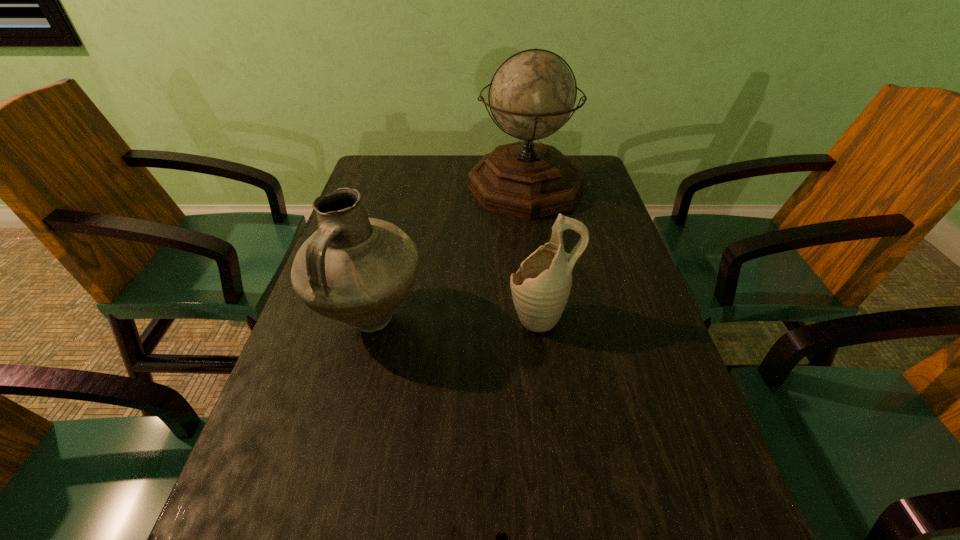
The width and height of the screenshot is (960, 540). In order to click on globe in this screenshot , I will do `click(532, 95)`.

Locate an element on the screen. This screenshot has height=540, width=960. the farthest object is located at coordinates (532, 95).

Locate an element on the screen. The width and height of the screenshot is (960, 540). the leftmost object is located at coordinates (354, 269).

This screenshot has width=960, height=540. What are the coordinates of `the left pitcher` in the screenshot? It's located at (354, 269).

Where is `the right pitcher`? The height and width of the screenshot is (540, 960). the right pitcher is located at coordinates (540, 289).

You are a GUI agent. You are given a task and a screenshot of the screen. Output one action in this format:
    pyautogui.click(x=<x>, y=<y>)
    Task: Click on the third tallest object
    This screenshot has height=540, width=960.
    Given the screenshot: What is the action you would take?
    pyautogui.click(x=540, y=289)

This screenshot has width=960, height=540. I want to click on vacant area located on the surface of the globe, so click(534, 242).

Find the location of a particular element. vacant space located on the handle side of the third shortest object is located at coordinates (325, 491).

The width and height of the screenshot is (960, 540). In order to click on vacant space located at the spout of the shorter pitcher in this screenshot , I will do `click(335, 318)`.

Find the location of `vacant space located at the spout of the shorter pitcher`. vacant space located at the spout of the shorter pitcher is located at coordinates (396, 318).